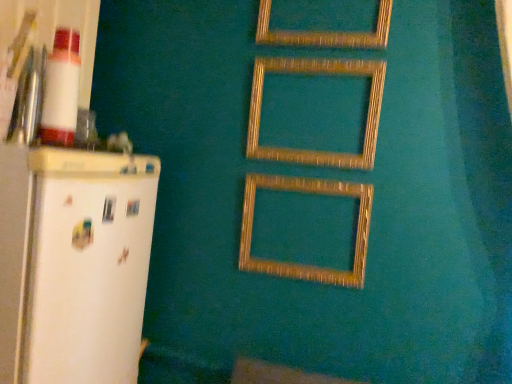
Question: Can you confirm if gold textured picture frame at center, the first picture frame ordered from the bottom, is wider than white matte refrigerator at left?

Choices:
 (A) yes
 (B) no

Answer: (B)

Question: Is gold textured picture frame at center, the 3th picture frame when ordered from top to bottom, turned away from white matte refrigerator at left?

Choices:
 (A) no
 (B) yes

Answer: (A)

Question: From the image's perspective, is gold textured picture frame at center, the 3th picture frame when ordered from top to bottom, on white matte refrigerator at left?

Choices:
 (A) yes
 (B) no

Answer: (A)

Question: Is gold textured picture frame at center, the 3th picture frame when ordered from top to bottom, at the right side of white matte refrigerator at left?

Choices:
 (A) yes
 (B) no

Answer: (A)

Question: Is gold textured picture frame at center, the first picture frame ordered from the bottom, far away from white matte refrigerator at left?

Choices:
 (A) yes
 (B) no

Answer: (B)

Question: In terms of height, does gold textured frame at upper center, which is the 3th picture frame in bottom-to-top order, look taller or shorter compared to wooden frame at center, placed as the 2th picture frame when sorted from top to bottom?

Choices:
 (A) short
 (B) tall

Answer: (B)

Question: In the image, is gold textured frame at upper center, which is the 3th picture frame in bottom-to-top order, positioned in front of or behind wooden frame at center, placed as the 2th picture frame when sorted from top to bottom?

Choices:
 (A) front
 (B) behind

Answer: (A)

Question: Is gold textured frame at upper center, the 1th picture frame when ordered from top to bottom, inside the boundaries of wooden frame at center, which is counted as the second picture frame, starting from the bottom, or outside?

Choices:
 (A) outside
 (B) inside

Answer: (A)

Question: From the image's perspective, is gold textured frame at upper center, the 1th picture frame when ordered from top to bottom, above or below wooden frame at center, which is counted as the second picture frame, starting from the bottom?

Choices:
 (A) below
 (B) above

Answer: (B)

Question: Is wooden frame at center, which is counted as the second picture frame, starting from the bottom, taller or shorter than gold textured frame at upper center, the 1th picture frame when ordered from top to bottom?

Choices:
 (A) tall
 (B) short

Answer: (B)

Question: From a real-world perspective, relative to gold textured frame at upper center, which is the 3th picture frame in bottom-to-top order, is wooden frame at center, which is counted as the second picture frame, starting from the bottom, vertically above or below?

Choices:
 (A) above
 (B) below

Answer: (B)

Question: Based on their positions, is wooden frame at center, which is counted as the second picture frame, starting from the bottom, located to the left or right of gold textured frame at upper center, which is the 3th picture frame in bottom-to-top order?

Choices:
 (A) right
 (B) left

Answer: (B)

Question: Would you say wooden frame at center, placed as the 2th picture frame when sorted from top to bottom, is inside or outside gold textured frame at upper center, the 1th picture frame when ordered from top to bottom?

Choices:
 (A) inside
 (B) outside

Answer: (B)

Question: Considering the positions of point (266, 59) and point (41, 370), is point (266, 59) closer or farther from the camera than point (41, 370)?

Choices:
 (A) closer
 (B) farther

Answer: (B)

Question: Considering their positions, is wooden frame at center, which is counted as the second picture frame, starting from the bottom, located in front of or behind white matte refrigerator at left?

Choices:
 (A) behind
 (B) front

Answer: (A)